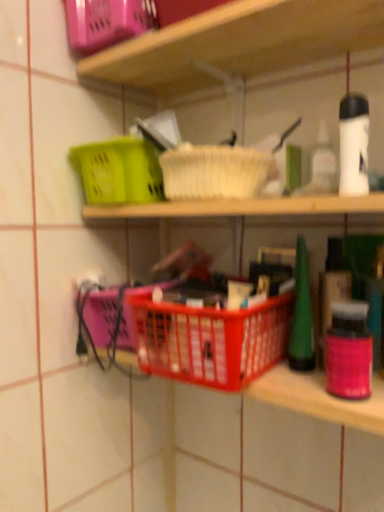
Question: Relative to plastic basket at center, is red plastic basket at center in front or behind?

Choices:
 (A) behind
 (B) front

Answer: (A)

Question: Is point (205, 380) closer or farther from the camera than point (284, 29)?

Choices:
 (A) farther
 (B) closer

Answer: (B)

Question: Which object is the closest to the plastic basket at center?

Choices:
 (A) red plastic basket at center
 (B) matte plastic basket at upper left

Answer: (B)

Question: Considering the real-world distances, which object is closest to the plastic basket at center?

Choices:
 (A) matte plastic basket at upper left
 (B) red plastic basket at center

Answer: (A)